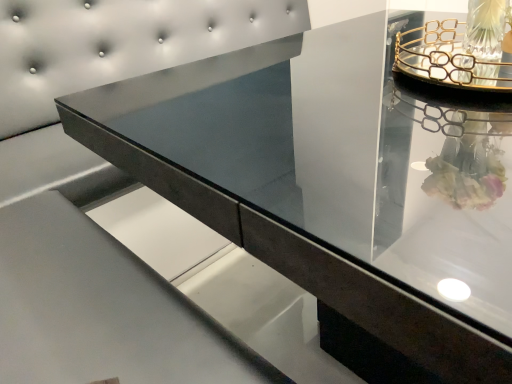
Where is `free space to the left of clear glass vase at upper right`? free space to the left of clear glass vase at upper right is located at coordinates (446, 100).